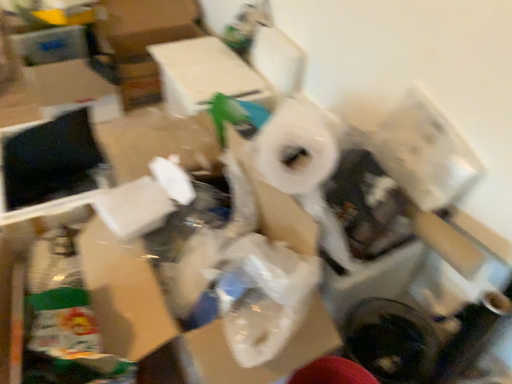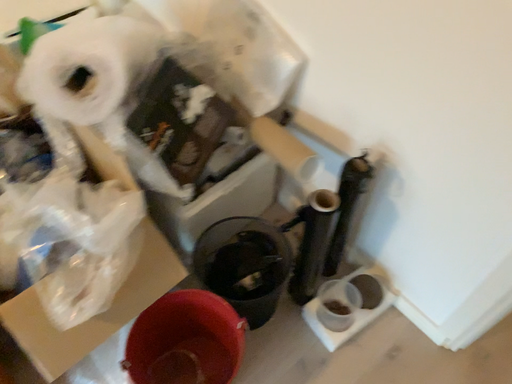
Question: How did the camera likely rotate when shooting the video?

Choices:
 (A) rotated right
 (B) rotated left

Answer: (A)